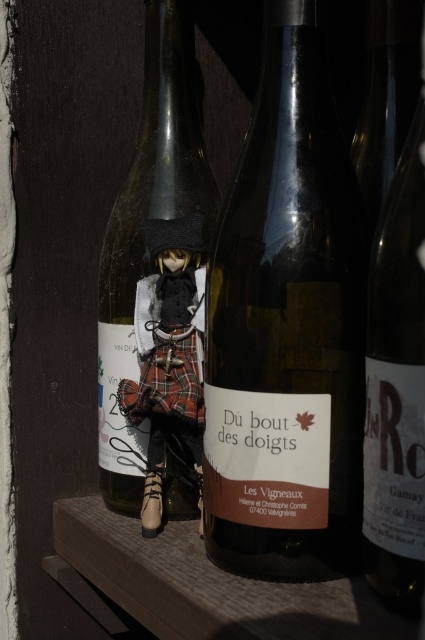
Question: Which point is farther from the camera taking this photo?

Choices:
 (A) (198, 248)
 (B) (405, 211)
 (C) (176, 330)

Answer: (A)

Question: Which point is closer to the camera taking this photo?

Choices:
 (A) (291, 124)
 (B) (161, 483)

Answer: (A)

Question: Does matte black wine at right appear over matte black doll at center?

Choices:
 (A) no
 (B) yes

Answer: (B)

Question: Can you confirm if matte glass wine bottle at center is positioned above transparent glass wine bottle at center?

Choices:
 (A) yes
 (B) no

Answer: (B)

Question: Is matte glass wine bottle at center positioned at the back of matte black doll at center?

Choices:
 (A) yes
 (B) no

Answer: (B)

Question: Which object is positioned farthest from the matte glass wine bottle at center?

Choices:
 (A) matte black wine at right
 (B) transparent glass wine bottle at center
 (C) matte black doll at center

Answer: (B)